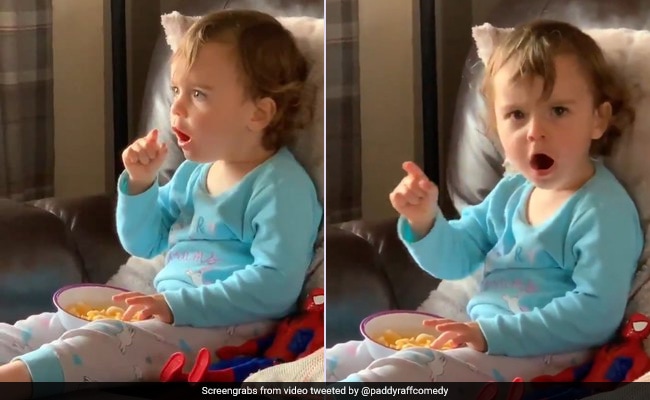
Where is `bowls`? This screenshot has width=650, height=400. bowls is located at coordinates (408, 316), (88, 289).